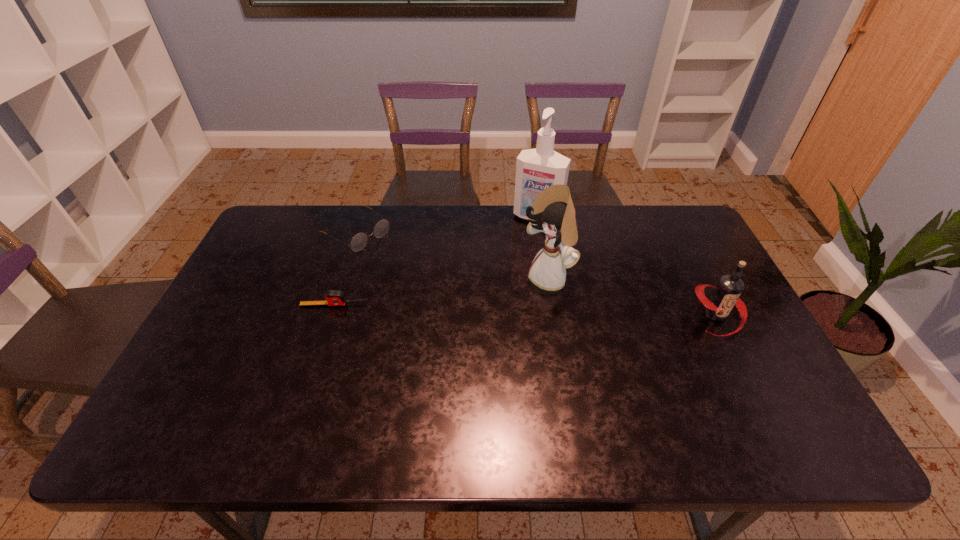
At what (x,y) coordinates should I click in order to perform the action: click on free spot between the tape measure and the spectacles. Please return your answer as a coordinate pair (x, y). The image size is (960, 540). Looking at the image, I should click on (346, 268).

I want to click on free space between the tallest object and the root beer, so click(627, 266).

Identify the location of vacant space in between the shortest object and the doll. (441, 292).

What are the coordinates of `free point between the cleansing agent and the second tallest object` in the screenshot? It's located at (542, 248).

Where is `empty space that is in between the cleansing agent and the doll`? empty space that is in between the cleansing agent and the doll is located at coordinates (542, 248).

Image resolution: width=960 pixels, height=540 pixels. In order to click on the third closest object to the tape measure in this screenshot , I will do `click(537, 169)`.

Choose which object is the third nearest neighbor to the root beer. Please provide its 2D coordinates. Your answer should be formatted as a tuple, i.e. [(x, y)], where the tuple contains the x and y coordinates of a point satisfying the conditions above.

[(359, 241)]

The width and height of the screenshot is (960, 540). Identify the location of free spot that satisfies the following two spatial constraints: 1. on the back side of the tallest object; 2. on the right side of the fourth tallest object. (362, 217).

I want to click on vacant space that satisfies the following two spatial constraints: 1. on the back side of the cleansing agent; 2. on the right side of the tape measure, so click(363, 217).

What are the coordinates of `vacant space that satisfies the following two spatial constraints: 1. on the back side of the cleansing agent; 2. on the left side of the shortest object` in the screenshot? It's located at (363, 217).